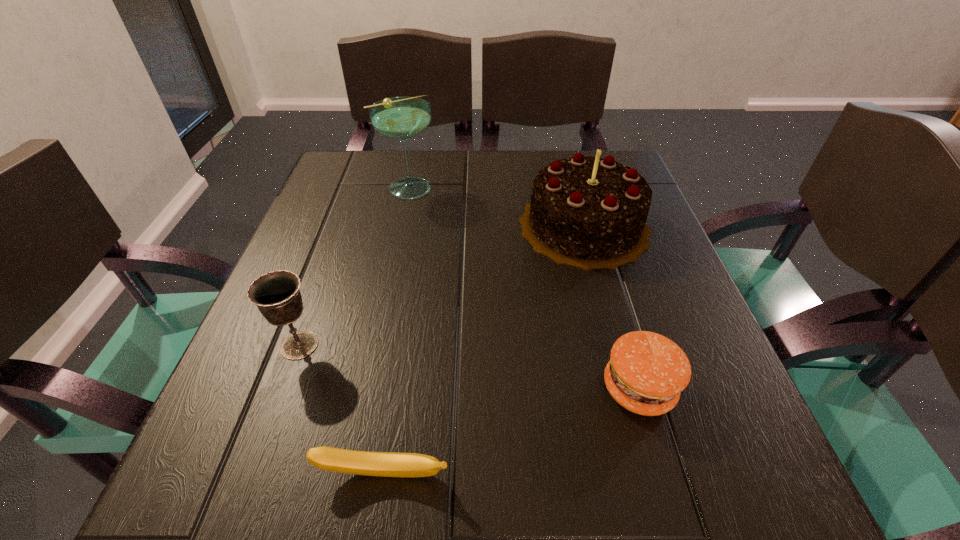
Locate an element on the screen. The height and width of the screenshot is (540, 960). martini is located at coordinates (403, 117).

Where is `birthday cake`? birthday cake is located at coordinates (588, 212).

Image resolution: width=960 pixels, height=540 pixels. Identify the location of the third tallest object. (276, 294).

The width and height of the screenshot is (960, 540). Identify the location of chalice. (276, 294).

Find the location of a particular element. This screenshot has height=540, width=960. the fourth tallest object is located at coordinates point(647,371).

Locate an element on the screen. The image size is (960, 540). the shortest object is located at coordinates (386, 464).

Locate an element on the screen. banana is located at coordinates (386, 464).

The height and width of the screenshot is (540, 960). Identify the location of free location located 0.140m on the right of the martini. (496, 188).

In order to click on vacant area situated 0.130m on the front of the birthday cake in this screenshot , I will do `click(611, 322)`.

Image resolution: width=960 pixels, height=540 pixels. In order to click on vacant region located on the front of the leftmost object in this screenshot , I will do `click(274, 417)`.